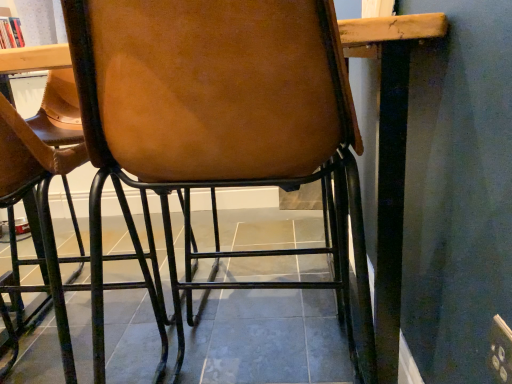
Question: Considering the relative sizes of white textured curtain at upper left and brown leather chair at center in the image provided, is white textured curtain at upper left wider than brown leather chair at center?

Choices:
 (A) no
 (B) yes

Answer: (A)

Question: Is brown leather chair at center completely or partially inside white textured curtain at upper left?

Choices:
 (A) yes
 (B) no

Answer: (B)

Question: From a real-world perspective, is white textured curtain at upper left on brown leather chair at center?

Choices:
 (A) yes
 (B) no

Answer: (A)

Question: Is white textured curtain at upper left smaller than brown leather chair at center?

Choices:
 (A) yes
 (B) no

Answer: (A)

Question: Does white textured curtain at upper left lie behind brown leather chair at center?

Choices:
 (A) yes
 (B) no

Answer: (A)

Question: Does white textured curtain at upper left turn towards brown leather chair at center?

Choices:
 (A) yes
 (B) no

Answer: (B)

Question: Is brown leather chair at center thinner than white textured curtain at upper left?

Choices:
 (A) yes
 (B) no

Answer: (B)

Question: Does brown leather chair at center appear on the right side of white textured curtain at upper left?

Choices:
 (A) no
 (B) yes

Answer: (B)

Question: From a real-world perspective, is brown leather chair at center positioned over white textured curtain at upper left based on gravity?

Choices:
 (A) yes
 (B) no

Answer: (B)

Question: Considering the relative sizes of brown leather chair at center and white textured curtain at upper left in the image provided, is brown leather chair at center bigger than white textured curtain at upper left?

Choices:
 (A) no
 (B) yes

Answer: (B)

Question: Is brown leather chair at center facing towards white textured curtain at upper left?

Choices:
 (A) yes
 (B) no

Answer: (B)

Question: Can you confirm if brown leather chair at center is smaller than white textured curtain at upper left?

Choices:
 (A) no
 (B) yes

Answer: (A)

Question: From the image's perspective, is white textured curtain at upper left positioned above or below brown leather chair at center?

Choices:
 (A) above
 (B) below

Answer: (A)